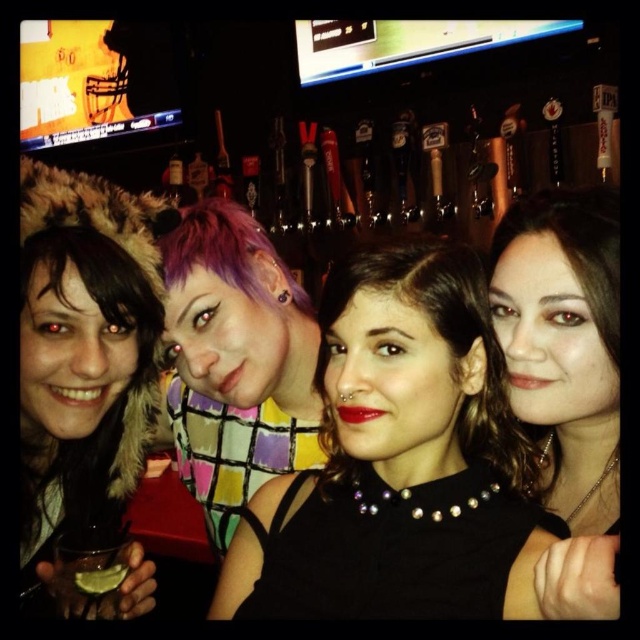
You are a bartender preparing drinks for a group. You have two cups available at the lower left corner of the counter. The clear glass at lower left and the translucent plastic cup at lower left. You need to choose a cup that can hold more liquid. Which one should you choose?

The clear glass at lower left is much taller than the translucent plastic cup at lower left, so it can hold more liquid.

You are a photographer at the bar scene. You want to place a new accessory exactly between the third person and the fourth person. The existing matte black necklace at center is already placed at point (566, 378). Is the new accessory likely to be closer to the third person or the fourth person?

The point (566, 378) marks the matte black necklace at center, so placing a new accessory exactly between the third person and the fourth person would require calculating the midpoint between their positions. Since the existing necklace is already at this point, it indicates that the necklace is equidistant from both the third and fourth persons. Therefore, the new accessory placed here would be equally close to both the third person and the fourth person.